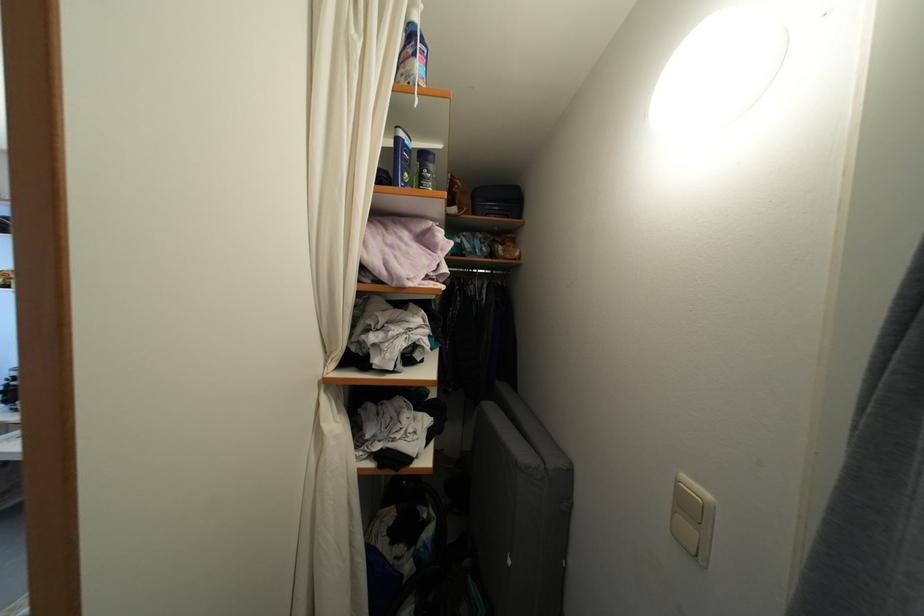
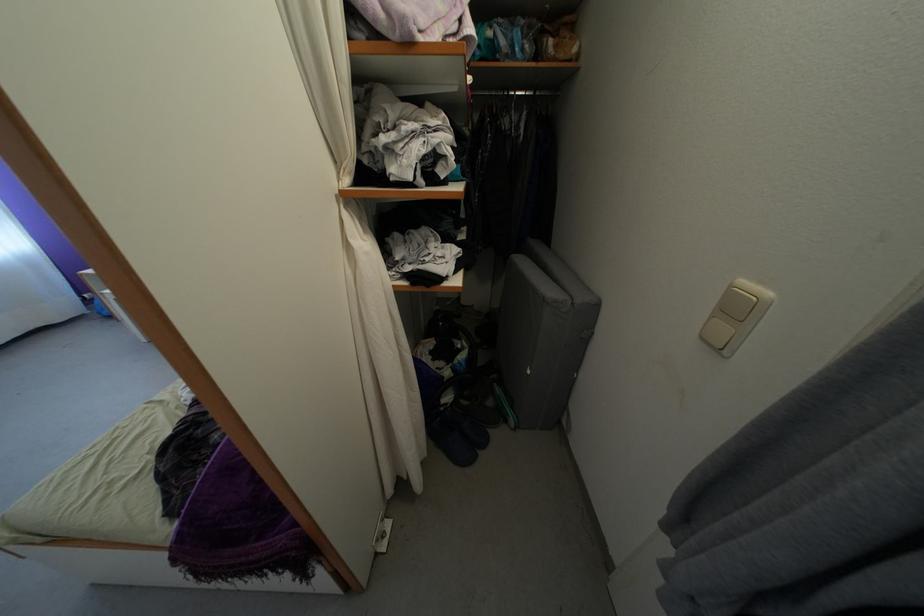
Locate, in the second image, the point that corresponds to point (327, 431) in the first image.

(356, 246)